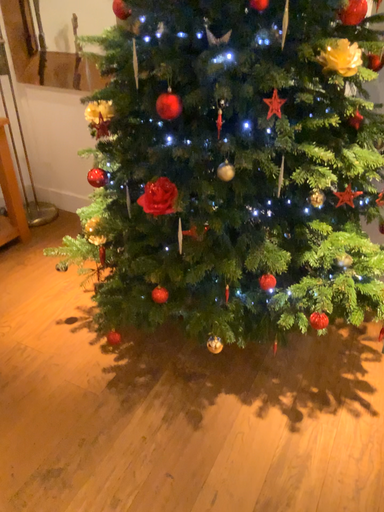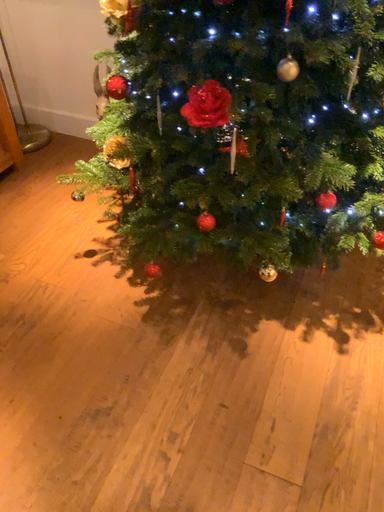
Question: Which way did the camera rotate in the video?

Choices:
 (A) rotated upward
 (B) rotated downward

Answer: (B)